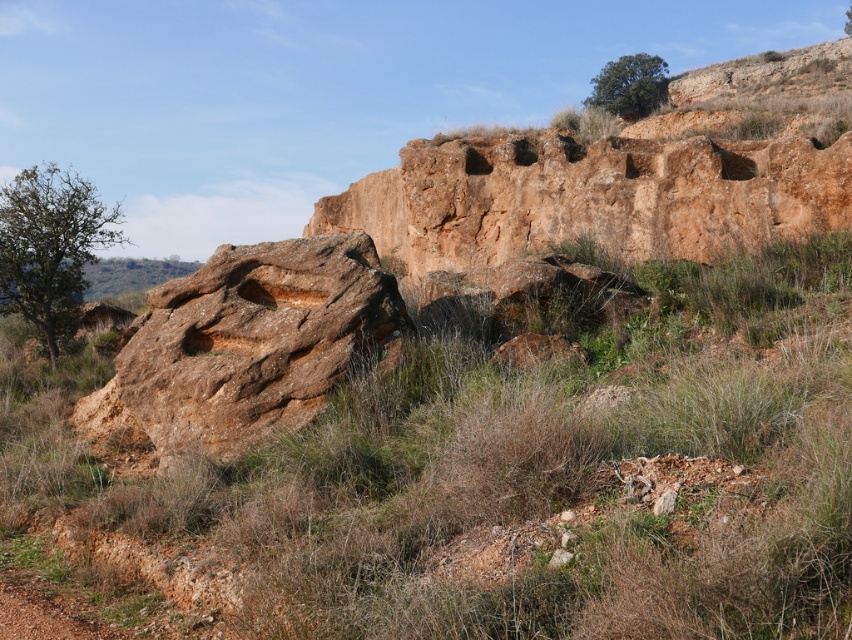
You are standing at the point with coordinates point (21, 580) and want to move towards the point (216, 403). Based on the landscape description, will you be moving towards or away from the large reddish brown rock formation?

Point (216, 403) is behind point (21, 580), so moving towards point (216, 403) means you are moving away from the large reddish brown rock formation.